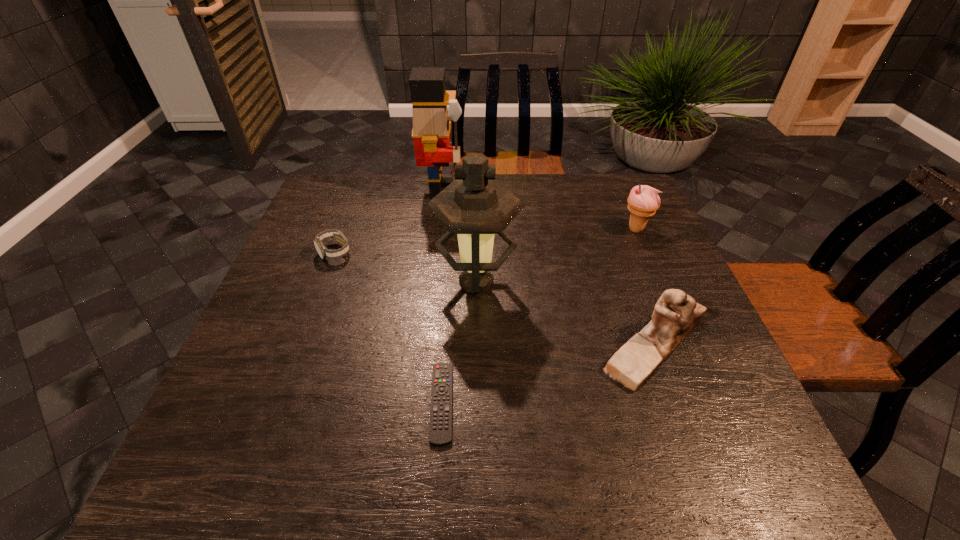
What are the coordinates of `vacant area between the oil lamp and the second shortest object` in the screenshot? It's located at point(405,267).

The height and width of the screenshot is (540, 960). Find the location of `free spot between the oil lamp and the figurine`. free spot between the oil lamp and the figurine is located at coordinates (565, 313).

The height and width of the screenshot is (540, 960). In order to click on empty space that is in between the leftmost object and the shortest object in this screenshot , I will do `click(388, 328)`.

Image resolution: width=960 pixels, height=540 pixels. Find the location of `blank region between the icecream and the nutcracker`. blank region between the icecream and the nutcracker is located at coordinates (539, 210).

Where is `free space between the oil lamp and the fifth nearest object`? Image resolution: width=960 pixels, height=540 pixels. free space between the oil lamp and the fifth nearest object is located at coordinates (556, 255).

At what (x,y) coordinates should I click in order to perform the action: click on free space between the shortest object and the figurine. Please return your answer as a coordinate pair (x, y). The image size is (960, 540). Looking at the image, I should click on (548, 374).

Identify the location of object that stands as the fourth closest to the figurine. (431, 129).

Locate which object ranks in proximity to the farthest object. Please provide its 2D coordinates. Your answer should be formatted as a tuple, i.e. [(x, y)], where the tuple contains the x and y coordinates of a point satisfying the conditions above.

[(324, 253)]

The height and width of the screenshot is (540, 960). Identify the location of vacant space that satisfies the following two spatial constraints: 1. in front of the oil lamp holding the staff; 2. on the left side of the farthest object. (431, 282).

Where is `free location that satisfies the following two spatial constraints: 1. on the face of the second shortest object; 2. on the right side of the oil lamp`? This screenshot has height=540, width=960. free location that satisfies the following two spatial constraints: 1. on the face of the second shortest object; 2. on the right side of the oil lamp is located at coordinates (324, 282).